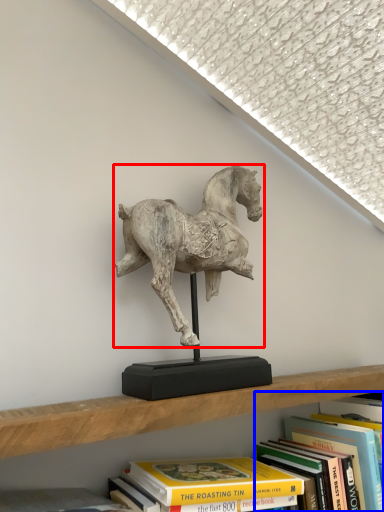
Question: Among these objects, which one is farthest to the camera, horse (highlighted by a red box) or book (highlighted by a blue box)?

Choices:
 (A) horse
 (B) book

Answer: (B)